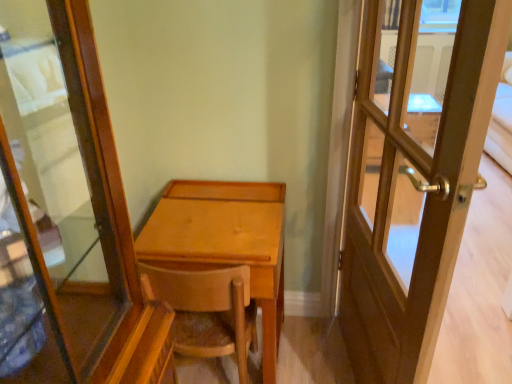
Question: Visually, is wooden door at right positioned to the left or to the right of wooden chair at center?

Choices:
 (A) right
 (B) left

Answer: (A)

Question: In terms of height, does wooden door at right look taller or shorter compared to wooden chair at center?

Choices:
 (A) tall
 (B) short

Answer: (A)

Question: Estimate the real-world distances between objects in this image. Which object is closer to the wooden chair at center?

Choices:
 (A) light brown wood desk at center
 (B) wooden door at right

Answer: (A)

Question: Based on their relative distances, which object is nearer to the light brown wood desk at center?

Choices:
 (A) wooden door at right
 (B) wooden chair at center

Answer: (B)